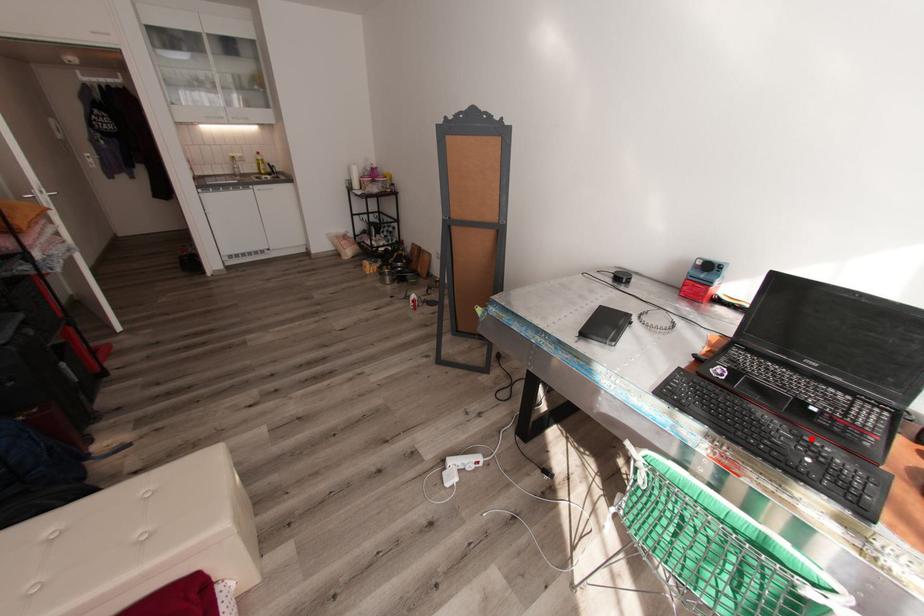
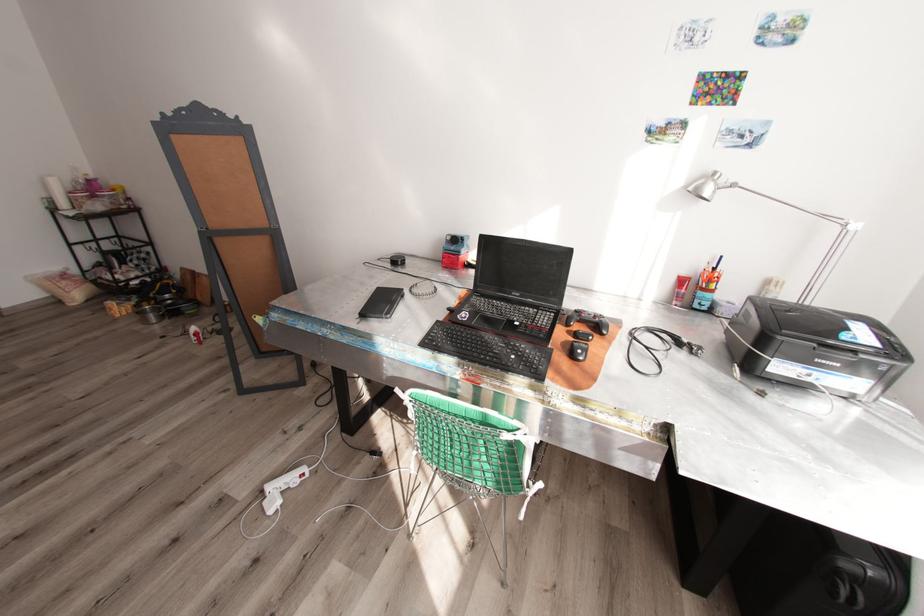
Find the pixel in the second image that matches the highlighted location in the first image.

(517, 344)